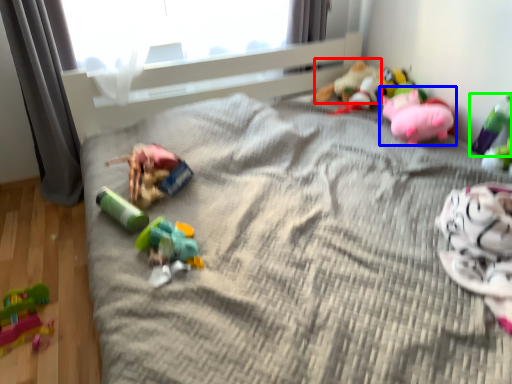
Question: Estimate the real-world distances between objects in this image. Which object is farther from toy (highlighted by a red box), toy (highlighted by a blue box) or toy (highlighted by a green box)?

Choices:
 (A) toy
 (B) toy

Answer: (B)